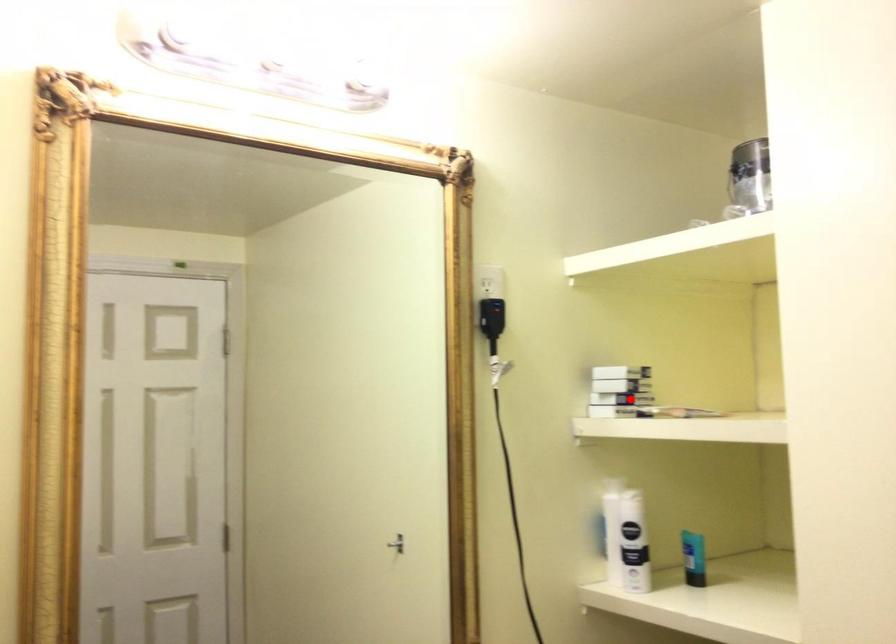
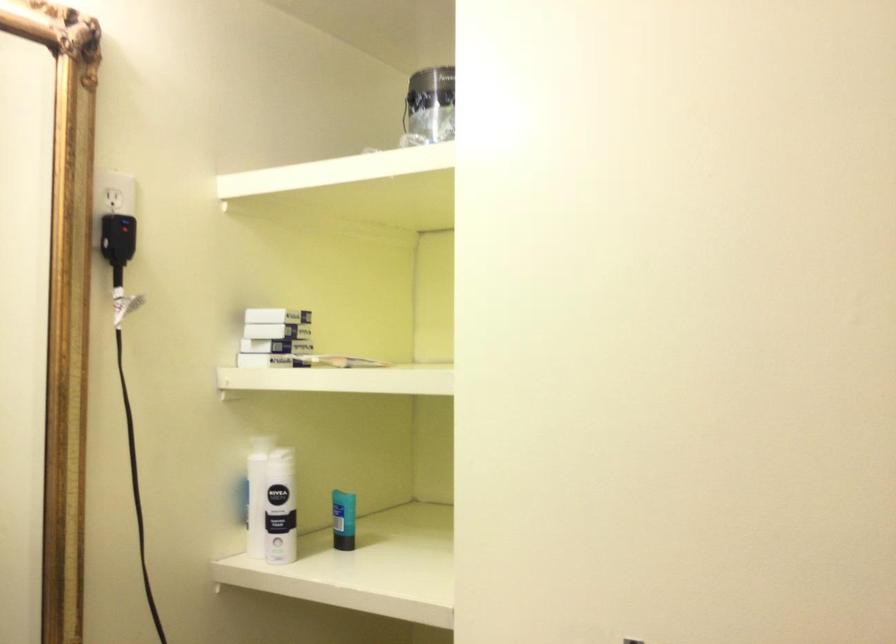
Question: I am providing you with two images of the same scene from different viewpoints. In image1, a red point is highlighted. Considering the same 3D point in image2, which of the following is correct?

Choices:
 (A) It is closer
 (B) It is farther

Answer: (A)